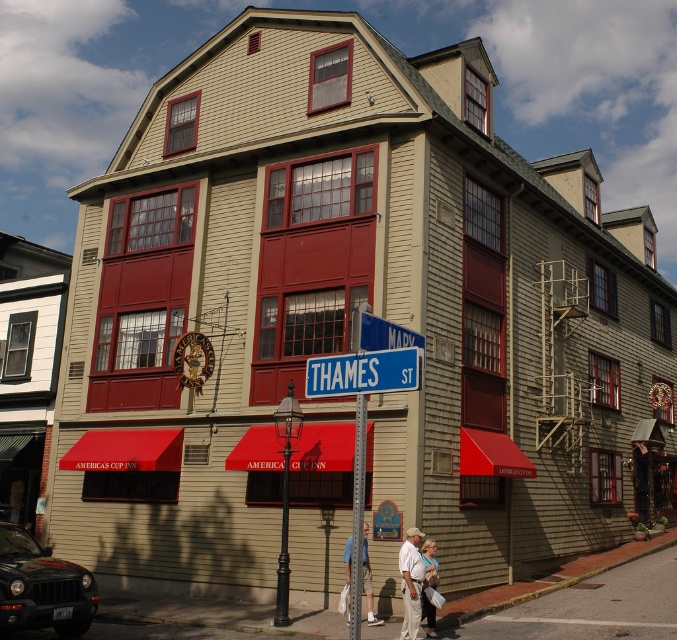
Question: Estimate the real-world distances between objects in this image. Which object is farther from the brushed metal pole at center?

Choices:
 (A) white cotton shirt at center
 (B) black matte car at lower left
 (C) blue metal street sign at center

Answer: (B)

Question: Considering the real-world distances, which object is farthest from the black matte car at lower left?

Choices:
 (A) light brown leather jacket at lower center
 (B) blue plastic street sign at upper center
 (C) white cotton shirt at center
 (D) light blue denim shorts at center

Answer: (B)

Question: Is brushed metal pole at center further to camera compared to white cotton shirt at center?

Choices:
 (A) yes
 (B) no

Answer: (B)

Question: Does white cotton shirt at center appear over light blue denim shorts at center?

Choices:
 (A) yes
 (B) no

Answer: (A)

Question: Does light blue denim shorts at center have a smaller size compared to light brown leather jacket at lower center?

Choices:
 (A) yes
 (B) no

Answer: (B)

Question: Based on their relative distances, which object is nearer to the brushed metal pole at center?

Choices:
 (A) blue metal street sign at center
 (B) light blue denim shorts at center
 (C) blue plastic street sign at upper center
 (D) black matte car at lower left

Answer: (A)